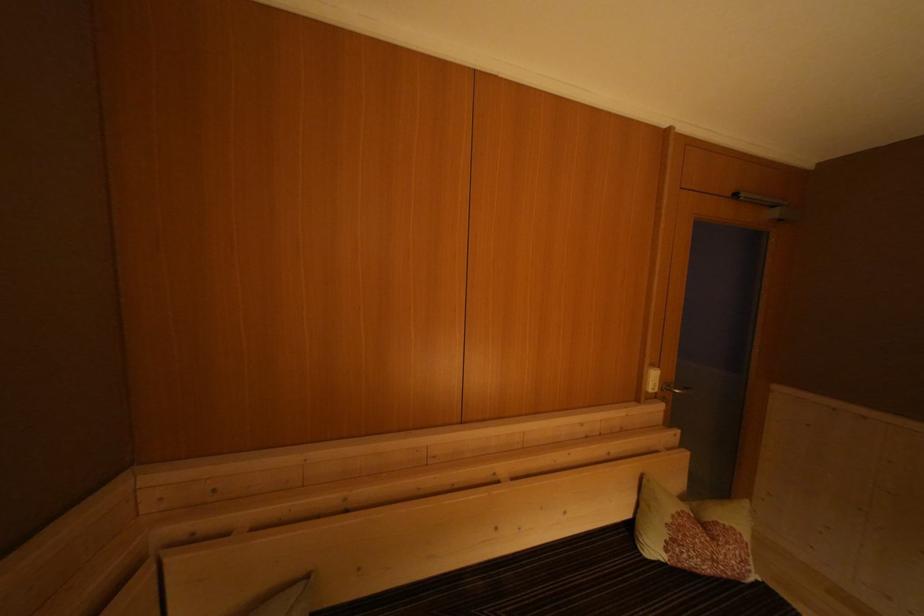
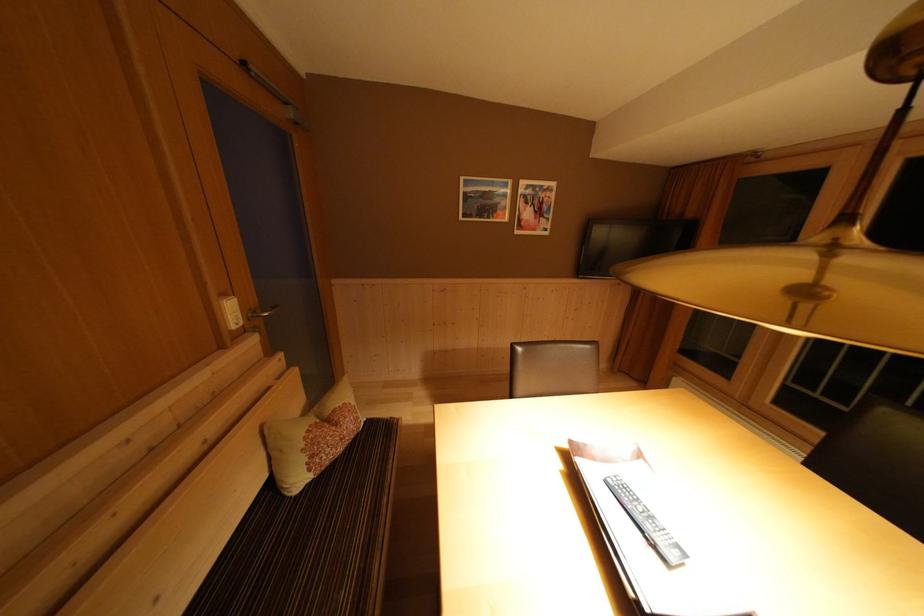
Locate, in the second image, the point that corresponds to point 672,391 in the first image.

(257, 318)